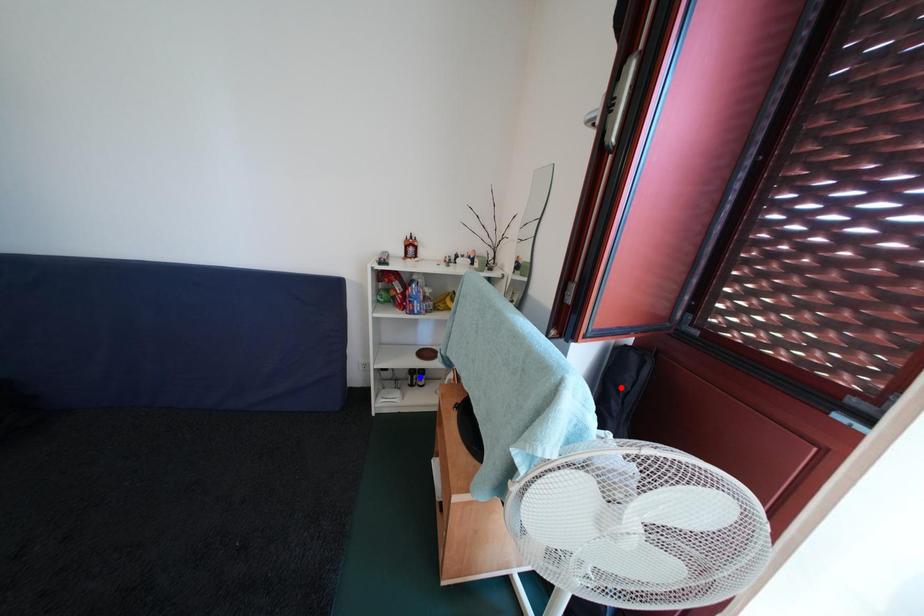
Question: Two points are marked on the image. Which point is closer to the camera?

Choices:
 (A) Blue point is closer.
 (B) Red point is closer.

Answer: (B)